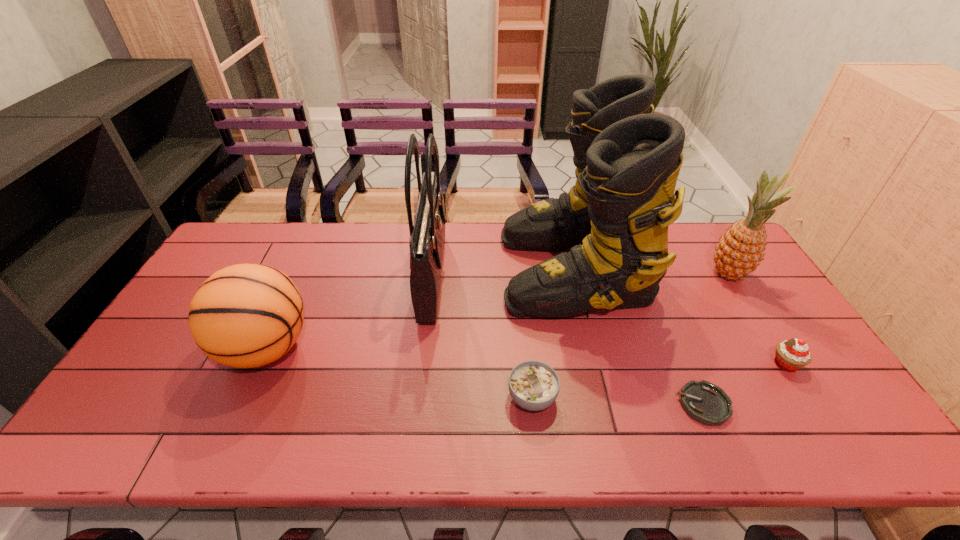
Image resolution: width=960 pixels, height=540 pixels. I want to click on vacant space situated with an open clasp on the front of the sixth shortest object, so click(534, 274).

In order to click on free space located 0.280m on the left of the third tallest object in this screenshot , I will do `click(619, 274)`.

Where is `free space located 0.380m on the right of the fourth tallest object`? The image size is (960, 540). free space located 0.380m on the right of the fourth tallest object is located at coordinates (454, 348).

The image size is (960, 540). In order to click on vacant space located on the left of the fifth tallest object in this screenshot , I will do `click(678, 364)`.

Image resolution: width=960 pixels, height=540 pixels. Find the location of `free location located 0.200m on the right of the second shortest object`. free location located 0.200m on the right of the second shortest object is located at coordinates (638, 397).

Where is `free region located 0.130m on the left of the ashtray`? free region located 0.130m on the left of the ashtray is located at coordinates (624, 404).

At what (x,y) coordinates should I click in order to perform the action: click on ski boots situated at the far edge. Please return your answer as a coordinate pair (x, y). Looking at the image, I should click on (616, 216).

Identify the location of handbag located at the far edge. The height and width of the screenshot is (540, 960). (427, 236).

In order to click on pineapple located in the far edge section of the desktop in this screenshot , I will do `click(741, 249)`.

At what (x,y) coordinates should I click in order to perform the action: click on soup bowl present at the near edge. Please return your answer as a coordinate pair (x, y). The image size is (960, 540). Looking at the image, I should click on (533, 385).